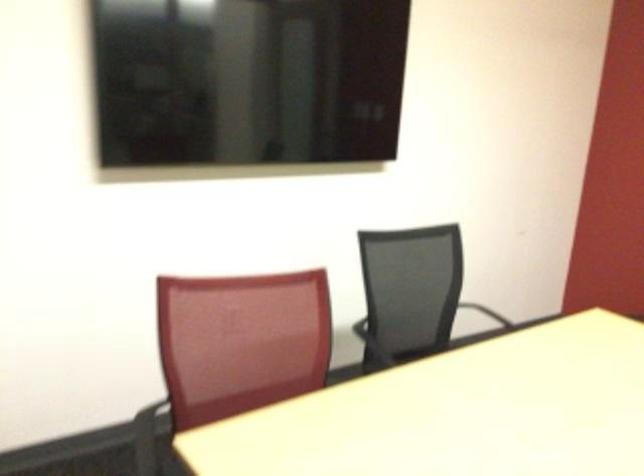
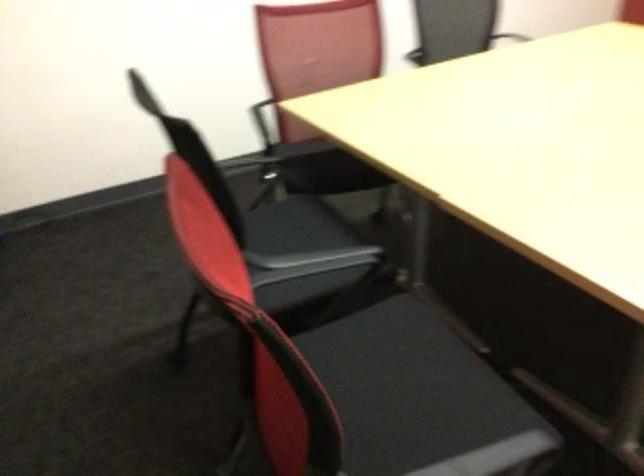
Question: Based on the continuous images, in which direction is the camera rotating? Reply with the corresponding letter.

Choices:
 (A) Left
 (B) Right
 (C) Up
 (D) Down

Answer: (D)